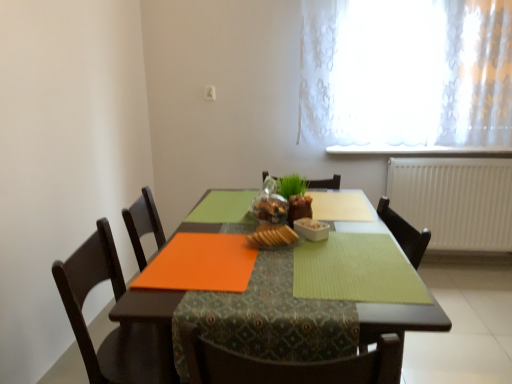
This screenshot has height=384, width=512. What are the coordinates of `blank space above white plastic radiator at right (from a real-world perspective)` in the screenshot? It's located at (453, 155).